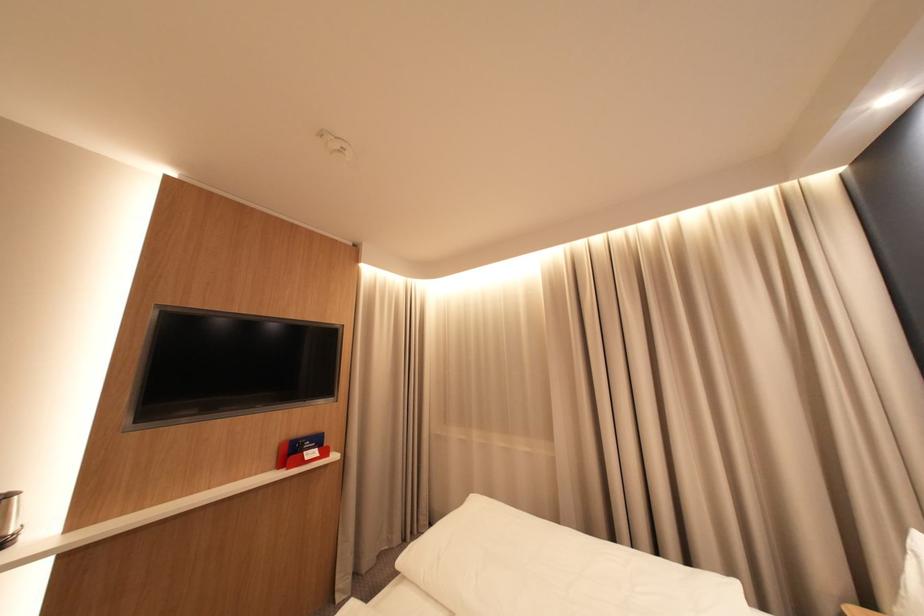
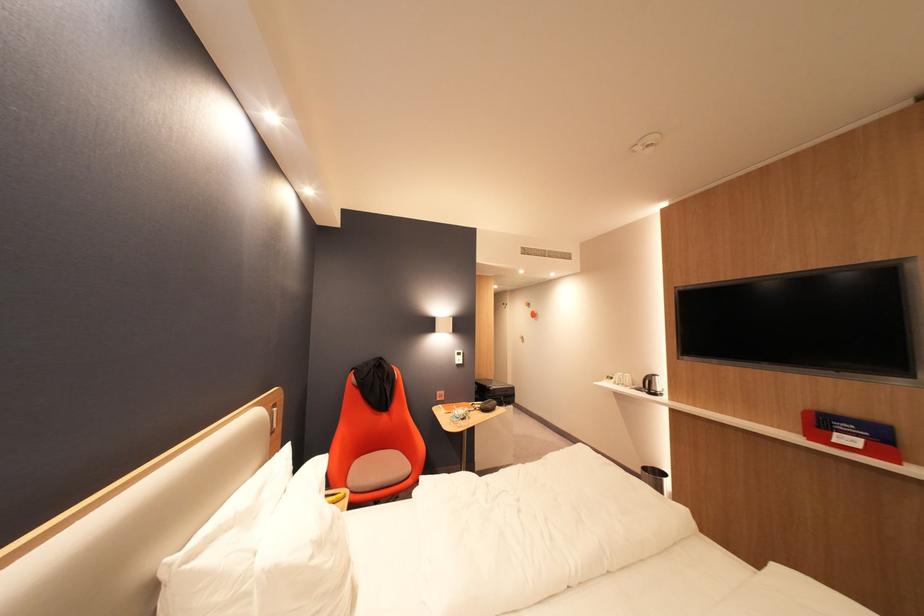
Where in the second image is the point corresponding to (x=314, y=455) from the first image?

(846, 435)